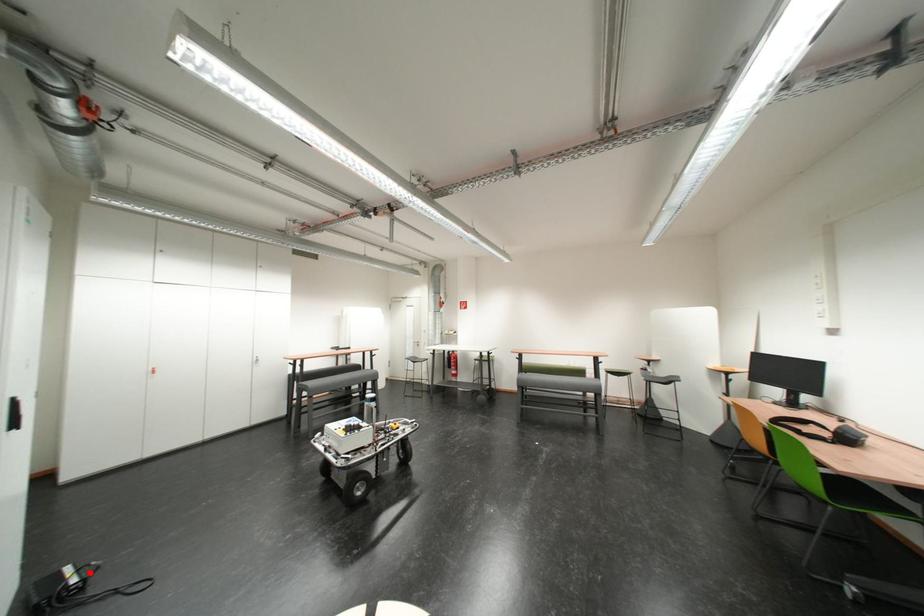
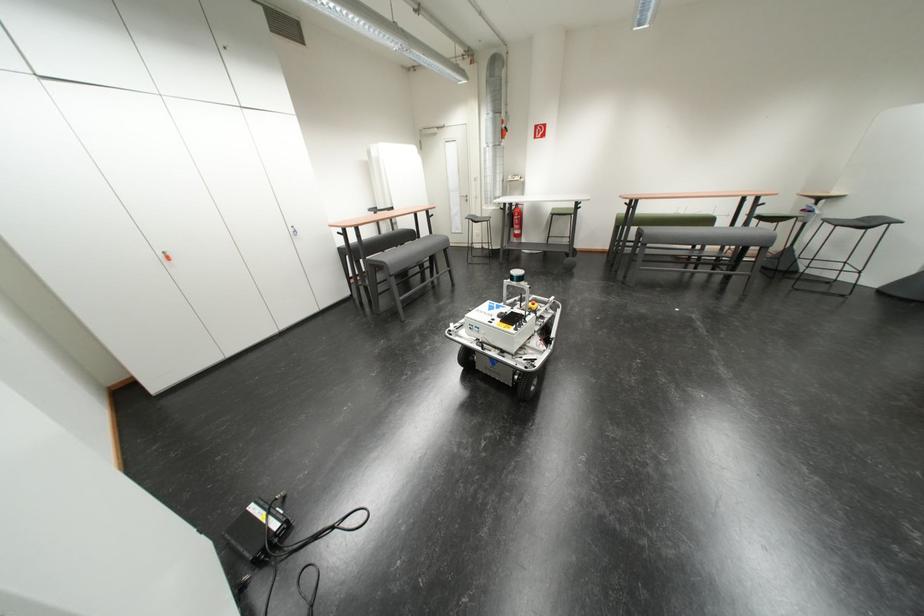
Question: A red point is marked in image1. In image2, is the corresponding 3D point closer to the camera or farther? Reply with the corresponding letter.

Choices:
 (A) The corresponding 3D point is closer.
 (B) The corresponding 3D point is farther.

Answer: (A)